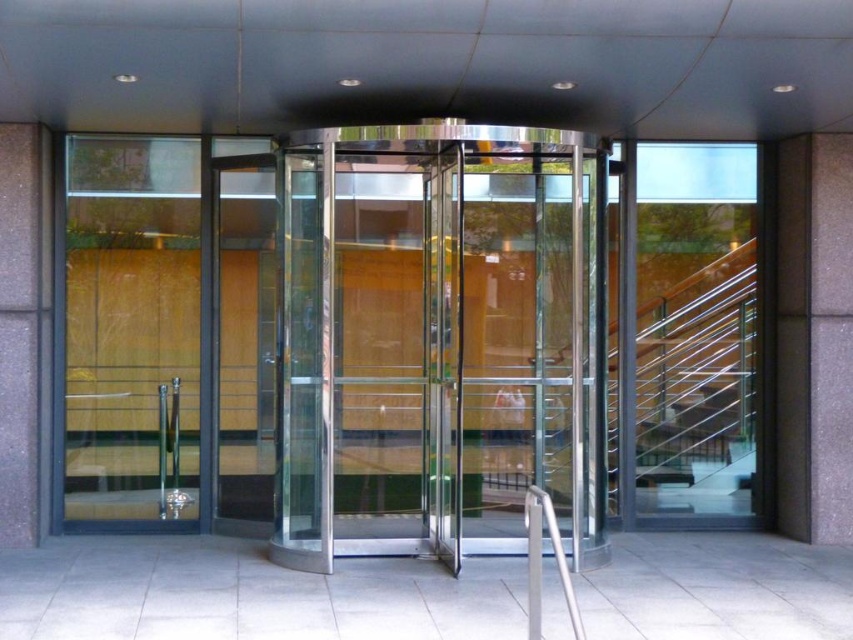
You are standing in front of the revolving door entrance. You need to grab the silver metallic handrail at center to enter the building. Is the polished silver glass door at center blocking your access to the handrail?

The polished silver glass door at center is located above the silver metallic handrail at center, so it does not block access to the handrail. You can reach the handrail below the door.

You are a delivery person trying to push a large box through the polished silver glass door at center. The silver metallic handrail at center might be in the way. Can you determine which object is taller to avoid collision?

The polished silver glass door at center is much taller than the silver metallic handrail at center, so the door poses a higher risk of collision when pushing the large box.

You are a delivery person with a large box that is 2 meters wide. You need to pass through the entrance shown in the image. Can your box fit through the space between the polished silver glass door at center and the silver metallic handrail at center?

The space between the polished silver glass door at center and the silver metallic handrail at center is 2.15 meters, which is wider than your 2 meter wide box. Therefore, your box can fit through the space between the polished silver glass door at center and the silver metallic handrail at center.